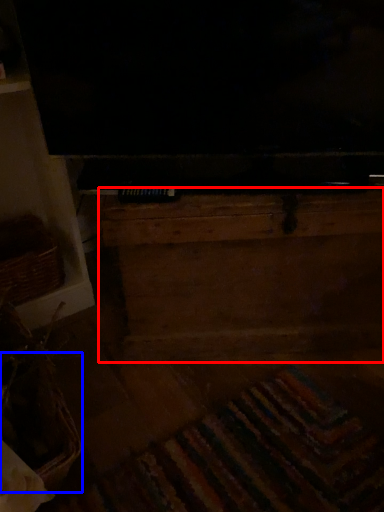
Question: Which of the following is the farthest to the observer, dresser (highlighted by a red box) or basket (highlighted by a blue box)?

Choices:
 (A) dresser
 (B) basket

Answer: (A)